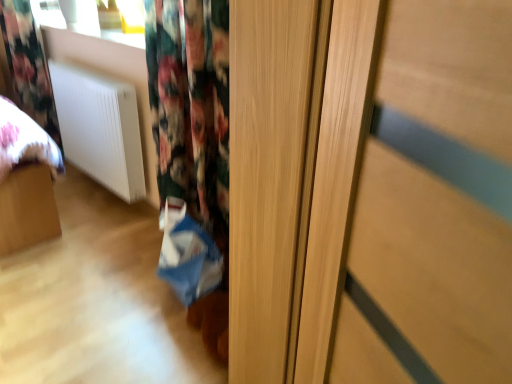
Question: Is floral fabric curtain at upper left touching blue fabric shopping bag at lower center?

Choices:
 (A) yes
 (B) no

Answer: (B)

Question: Can you confirm if floral fabric curtain at upper left is taller than blue fabric shopping bag at lower center?

Choices:
 (A) no
 (B) yes

Answer: (B)

Question: Does floral fabric curtain at upper left have a lesser height compared to blue fabric shopping bag at lower center?

Choices:
 (A) yes
 (B) no

Answer: (B)

Question: Could you tell me if floral fabric curtain at upper left is facing blue fabric shopping bag at lower center?

Choices:
 (A) no
 (B) yes

Answer: (A)

Question: Considering the relative sizes of floral fabric curtain at upper left and blue fabric shopping bag at lower center in the image provided, is floral fabric curtain at upper left wider than blue fabric shopping bag at lower center?

Choices:
 (A) yes
 (B) no

Answer: (B)

Question: From a real-world perspective, relative to white matte radiator at lower left, is blue fabric shopping bag at lower center vertically above or below?

Choices:
 (A) below
 (B) above

Answer: (A)

Question: Considering the relative positions of blue fabric shopping bag at lower center and white matte radiator at lower left in the image provided, is blue fabric shopping bag at lower center to the left or to the right of white matte radiator at lower left?

Choices:
 (A) right
 (B) left

Answer: (A)

Question: Considering the positions of point (207, 286) and point (121, 195), is point (207, 286) closer or farther from the camera than point (121, 195)?

Choices:
 (A) farther
 (B) closer

Answer: (B)

Question: Is blue fabric shopping bag at lower center in front of or behind white matte radiator at lower left in the image?

Choices:
 (A) behind
 (B) front

Answer: (B)

Question: Would you say blue fabric shopping bag at lower center is to the left or to the right of floral fabric curtain at upper left in the picture?

Choices:
 (A) right
 (B) left

Answer: (A)

Question: From a real-world perspective, is blue fabric shopping bag at lower center above or below floral fabric curtain at upper left?

Choices:
 (A) above
 (B) below

Answer: (B)

Question: Is blue fabric shopping bag at lower center in front of or behind floral fabric curtain at upper left in the image?

Choices:
 (A) front
 (B) behind

Answer: (A)

Question: Considering the positions of blue fabric shopping bag at lower center and floral fabric curtain at upper left in the image, is blue fabric shopping bag at lower center bigger or smaller than floral fabric curtain at upper left?

Choices:
 (A) small
 (B) big

Answer: (A)

Question: Choose the correct answer: Is floral fabric curtain at upper left inside white matte radiator at lower left or outside it?

Choices:
 (A) inside
 (B) outside

Answer: (B)

Question: In terms of height, does floral fabric curtain at upper left look taller or shorter compared to white matte radiator at lower left?

Choices:
 (A) short
 (B) tall

Answer: (B)